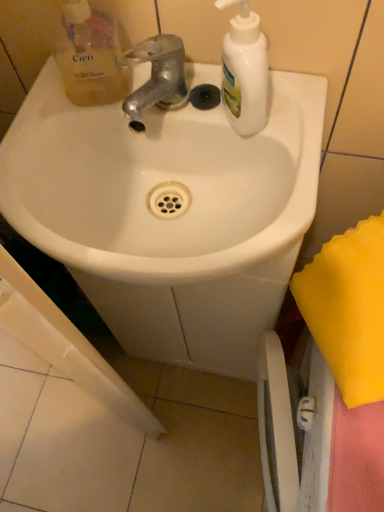
Where is `white matte bottle at upper right`? The height and width of the screenshot is (512, 384). white matte bottle at upper right is located at coordinates tap(244, 71).

What do you see at coordinates (161, 182) in the screenshot? I see `white glossy sink at center` at bounding box center [161, 182].

This screenshot has width=384, height=512. Describe the element at coordinates (157, 75) in the screenshot. I see `shiny metallic faucet at center` at that location.

Locate an element on the screen. translucent yellow liquid soap at upper left is located at coordinates (89, 55).

Is translucent yellow liquid soap at upper left beside shiny metallic faucet at center?

Yes, translucent yellow liquid soap at upper left is beside shiny metallic faucet at center.

Can you confirm if translucent yellow liquid soap at upper left is positioned to the right of shiny metallic faucet at center?

Incorrect, translucent yellow liquid soap at upper left is not on the right side of shiny metallic faucet at center.

Is translucent yellow liquid soap at upper left positioned beyond the bounds of shiny metallic faucet at center?

Absolutely, translucent yellow liquid soap at upper left is external to shiny metallic faucet at center.

Can you confirm if shiny metallic faucet at center is positioned to the left of white matte bottle at upper right?

Indeed, shiny metallic faucet at center is positioned on the left side of white matte bottle at upper right.

The height and width of the screenshot is (512, 384). What are the coordinates of `tap behind the white matte bottle at upper right` in the screenshot? It's located at (157, 75).

Does point (139, 104) come closer to viewer compared to point (256, 97)?

No.

From the picture: From a real-world perspective, is white glossy sink at center physically located above or below shiny metallic faucet at center?

Clearly, from a real-world perspective, white glossy sink at center is below shiny metallic faucet at center.

From the image's perspective, between white glossy sink at center and shiny metallic faucet at center, which one is located above?

shiny metallic faucet at center.

Are white glossy sink at center and shiny metallic faucet at center located far from each other?

They are positioned close to each other.

Consider the image. Choose the correct answer: Is white glossy sink at center inside shiny metallic faucet at center or outside it?

white glossy sink at center is not inside shiny metallic faucet at center, it's outside.

Are translucent yellow liquid soap at upper left and white matte bottle at upper right located far from each other?

That's not correct — translucent yellow liquid soap at upper left is a little close to white matte bottle at upper right.

From a real-world perspective, which object rests below the other?

In real-world perspective, translucent yellow liquid soap at upper left is lower.

Considering the sizes of objects translucent yellow liquid soap at upper left and white matte bottle at upper right in the image provided, who is taller, translucent yellow liquid soap at upper left or white matte bottle at upper right?

white matte bottle at upper right is taller.

Which object is positioned more to the left, white matte bottle at upper right or white glossy sink at center?

From the viewer's perspective, white glossy sink at center appears more on the left side.

Is white glossy sink at center at the back of white matte bottle at upper right?

white matte bottle at upper right does not have its back to white glossy sink at center.

Is white matte bottle at upper right inside or outside of white glossy sink at center?

white matte bottle at upper right is spatially situated outside white glossy sink at center.

Which is less distant, (257,112) or (84,166)?

Point (257,112) is positioned closer to the camera compared to point (84,166).

Considering the positions of objects white matte bottle at upper right and shiny metallic faucet at center in the image provided, who is more to the right, white matte bottle at upper right or shiny metallic faucet at center?

white matte bottle at upper right.

In the image, is white matte bottle at upper right positioned in front of or behind shiny metallic faucet at center?

white matte bottle at upper right is in front of shiny metallic faucet at center.

From the picture: Is white matte bottle at upper right positioned with its back to shiny metallic faucet at center?

No, white matte bottle at upper right is not facing the opposite direction of shiny metallic faucet at center.

From the image's perspective, is white matte bottle at upper right under shiny metallic faucet at center?

Yes, from the image's perspective, white matte bottle at upper right is below shiny metallic faucet at center.

Considering the relative sizes of white matte bottle at upper right and translucent yellow liquid soap at upper left in the image provided, is white matte bottle at upper right thinner than translucent yellow liquid soap at upper left?

In fact, white matte bottle at upper right might be wider than translucent yellow liquid soap at upper left.

Is white matte bottle at upper right closer to the viewer compared to translucent yellow liquid soap at upper left?

Yes, the depth of white matte bottle at upper right is less than that of translucent yellow liquid soap at upper left.

The width and height of the screenshot is (384, 512). I want to click on product lying on the left of shiny metallic faucet at center, so click(x=89, y=55).

The height and width of the screenshot is (512, 384). What are the coordinates of `cleaning product below the shiny metallic faucet at center (from the image's perspective)` in the screenshot? It's located at (244, 71).

From the picture: Which object lies nearer to the anchor point translucent yellow liquid soap at upper left, white matte bottle at upper right or shiny metallic faucet at center?

shiny metallic faucet at center.

From the image, which object appears to be farther from white glossy sink at center, translucent yellow liquid soap at upper left or white matte bottle at upper right?

white matte bottle at upper right is positioned further to the anchor white glossy sink at center.

When comparing their distances from shiny metallic faucet at center, does translucent yellow liquid soap at upper left or white glossy sink at center seem closer?

The object closer to shiny metallic faucet at center is translucent yellow liquid soap at upper left.

Looking at the image, which one is located closer to shiny metallic faucet at center, white matte bottle at upper right or white glossy sink at center?

Among the two, white matte bottle at upper right is located nearer to shiny metallic faucet at center.

Looking at the image, which one is located closer to shiny metallic faucet at center, white matte bottle at upper right or translucent yellow liquid soap at upper left?

The object closer to shiny metallic faucet at center is translucent yellow liquid soap at upper left.

From the image, which object appears to be nearer to translucent yellow liquid soap at upper left, shiny metallic faucet at center or white glossy sink at center?

shiny metallic faucet at center lies closer to translucent yellow liquid soap at upper left than the other object.

Based on their spatial positions, is translucent yellow liquid soap at upper left or white glossy sink at center closer to white matte bottle at upper right?

The object closer to white matte bottle at upper right is white glossy sink at center.

Estimate the real-world distances between objects in this image. Which object is closer to white matte bottle at upper right, white glossy sink at center or shiny metallic faucet at center?

The object closer to white matte bottle at upper right is shiny metallic faucet at center.

Identify the location of tap between translucent yellow liquid soap at upper left and white matte bottle at upper right in the horizontal direction. (157, 75).

Locate an element on the screen. This screenshot has width=384, height=512. sink situated between translucent yellow liquid soap at upper left and white matte bottle at upper right from left to right is located at coordinates (161, 182).

You are a GUI agent. You are given a task and a screenshot of the screen. Output one action in this format:
    pyautogui.click(x=<x>, y=<y>)
    Task: Click on the tap that lies between translucent yellow liquid soap at upper left and white glossy sink at center from top to bottom
    The image size is (384, 512).
    Given the screenshot: What is the action you would take?
    pyautogui.click(x=157, y=75)

The height and width of the screenshot is (512, 384). I want to click on cleaning product between shiny metallic faucet at center and white glossy sink at center in the vertical direction, so click(244, 71).